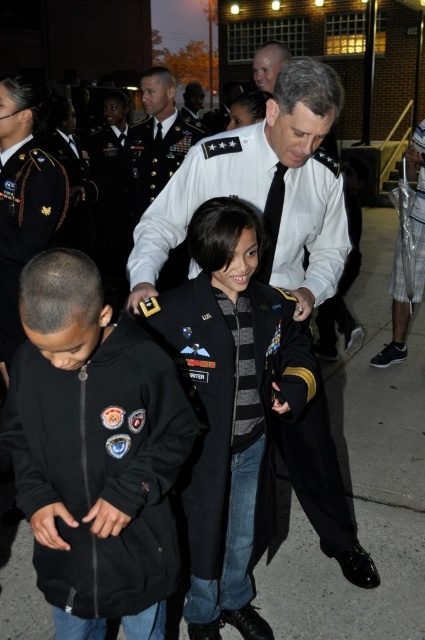
Consider the image. You are a photographer at the event and need to frame a photo that includes both the dark green uniform at center and the smooth bald head at upper center. Which object should you adjust your camera to focus on first to ensure both are in the frame?

The dark green uniform at center is bigger than the smooth bald head at upper center, so you should focus on the dark green uniform at center first to ensure both are in the frame.

You are a photographer at this event and need to capture a clear photo of both the black fleece jacket at lower left and the dark blue wool jacket at center. Since you want both subjects to be in focus, which jacket should you focus on first to ensure depth of field captures both?

The black fleece jacket at lower left is closer to the viewer than the dark blue wool jacket at center. To ensure both are in focus, you should focus on the dark blue wool jacket at center, as depth of field extends further behind the point of focus than in front of it.